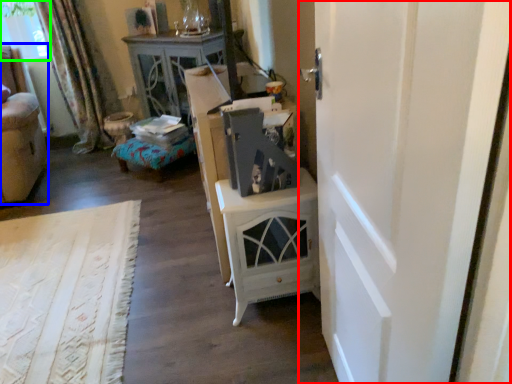
Question: Estimate the real-world distances between objects in this image. Which object is closer to door (highlighted by a red box), furniture (highlighted by a blue box) or window screen (highlighted by a green box)?

Choices:
 (A) furniture
 (B) window screen

Answer: (A)